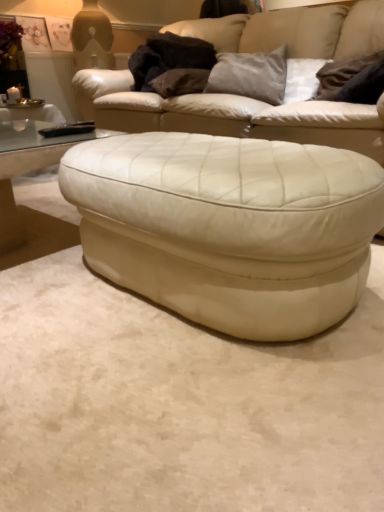
Question: Is black leather remote at left taller than suede gray pillow at upper center, arranged as the 2th pillow when viewed from the right?

Choices:
 (A) no
 (B) yes

Answer: (A)

Question: Considering the relative sizes of black leather remote at left and suede gray pillow at upper center, arranged as the 2th pillow when viewed from the right, in the image provided, is black leather remote at left smaller than suede gray pillow at upper center, arranged as the 2th pillow when viewed from the right,?

Choices:
 (A) yes
 (B) no

Answer: (A)

Question: From a real-world perspective, is black leather remote at left located higher than suede gray pillow at upper center, arranged as the 2th pillow when viewed from the right?

Choices:
 (A) yes
 (B) no

Answer: (B)

Question: Can you confirm if black leather remote at left is shorter than suede gray pillow at upper center, arranged as the 2th pillow when viewed from the right?

Choices:
 (A) no
 (B) yes

Answer: (B)

Question: Could you tell me if black leather remote at left is turned towards suede gray pillow at upper center, arranged as the 2th pillow when viewed from the right?

Choices:
 (A) no
 (B) yes

Answer: (A)

Question: Does black leather remote at left have a larger size compared to suede gray pillow at upper center, arranged as the 2th pillow when viewed from the right?

Choices:
 (A) no
 (B) yes

Answer: (A)

Question: Does suede gray pillow at upper center, arranged as the 2th pillow when viewed from the right, turn towards transparent glass coffee table at lower left?

Choices:
 (A) no
 (B) yes

Answer: (A)

Question: Is suede gray pillow at upper center, positioned as the second pillow in left-to-right order, shorter than transparent glass coffee table at lower left?

Choices:
 (A) yes
 (B) no

Answer: (A)

Question: Can you confirm if suede gray pillow at upper center, arranged as the 2th pillow when viewed from the right, is positioned to the left of transparent glass coffee table at lower left?

Choices:
 (A) no
 (B) yes

Answer: (A)

Question: Considering the relative sizes of suede gray pillow at upper center, arranged as the 2th pillow when viewed from the right, and transparent glass coffee table at lower left in the image provided, is suede gray pillow at upper center, arranged as the 2th pillow when viewed from the right, bigger than transparent glass coffee table at lower left?

Choices:
 (A) yes
 (B) no

Answer: (B)

Question: Are suede gray pillow at upper center, positioned as the second pillow in left-to-right order, and transparent glass coffee table at lower left beside each other?

Choices:
 (A) yes
 (B) no

Answer: (B)

Question: Can you confirm if suede gray pillow at upper center, arranged as the 2th pillow when viewed from the right, is thinner than transparent glass coffee table at lower left?

Choices:
 (A) no
 (B) yes

Answer: (B)

Question: Is transparent glass coffee table at lower left further to the viewer compared to white leather ottoman at center?

Choices:
 (A) no
 (B) yes

Answer: (B)